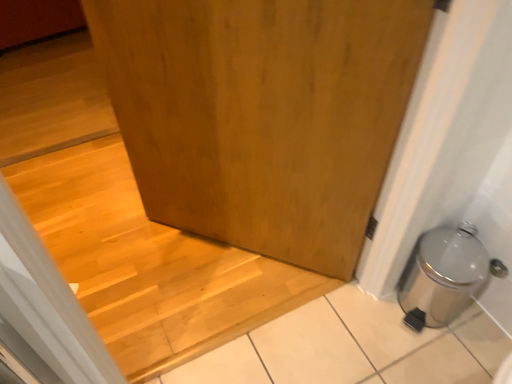
Question: From a real-world perspective, is silver metallic trash can at lower right on top of wooden door at center?

Choices:
 (A) no
 (B) yes

Answer: (A)

Question: Is silver metallic trash can at lower right at the left side of wooden door at center?

Choices:
 (A) yes
 (B) no

Answer: (B)

Question: From the image's perspective, does silver metallic trash can at lower right appear lower than wooden door at center?

Choices:
 (A) no
 (B) yes

Answer: (B)

Question: Does silver metallic trash can at lower right turn towards wooden door at center?

Choices:
 (A) yes
 (B) no

Answer: (B)

Question: Can you confirm if silver metallic trash can at lower right is wider than wooden door at center?

Choices:
 (A) no
 (B) yes

Answer: (B)

Question: Relative to wooden at center, is silver metallic trash can at lower right in front or behind?

Choices:
 (A) front
 (B) behind

Answer: (A)

Question: Is silver metallic trash can at lower right to the left or to the right of wooden at center in the image?

Choices:
 (A) left
 (B) right

Answer: (B)

Question: Considering the positions of silver metallic trash can at lower right and wooden at center in the image, is silver metallic trash can at lower right taller or shorter than wooden at center?

Choices:
 (A) short
 (B) tall

Answer: (B)

Question: Looking at the image, does silver metallic trash can at lower right seem bigger or smaller compared to wooden at center?

Choices:
 (A) big
 (B) small

Answer: (B)

Question: In the image, is wooden at center positioned in front of or behind wooden door at center?

Choices:
 (A) behind
 (B) front

Answer: (A)

Question: From a real-world perspective, relative to wooden door at center, is wooden at center vertically above or below?

Choices:
 (A) above
 (B) below

Answer: (B)

Question: Based on their sizes in the image, would you say wooden at center is bigger or smaller than wooden door at center?

Choices:
 (A) small
 (B) big

Answer: (A)

Question: From their relative heights in the image, would you say wooden at center is taller or shorter than wooden door at center?

Choices:
 (A) tall
 (B) short

Answer: (B)

Question: From the image's perspective, relative to silver metallic trash can at lower right, is wooden at center above or below?

Choices:
 (A) below
 (B) above

Answer: (B)

Question: In the image, is wooden at center on the left side or the right side of silver metallic trash can at lower right?

Choices:
 (A) left
 (B) right

Answer: (A)